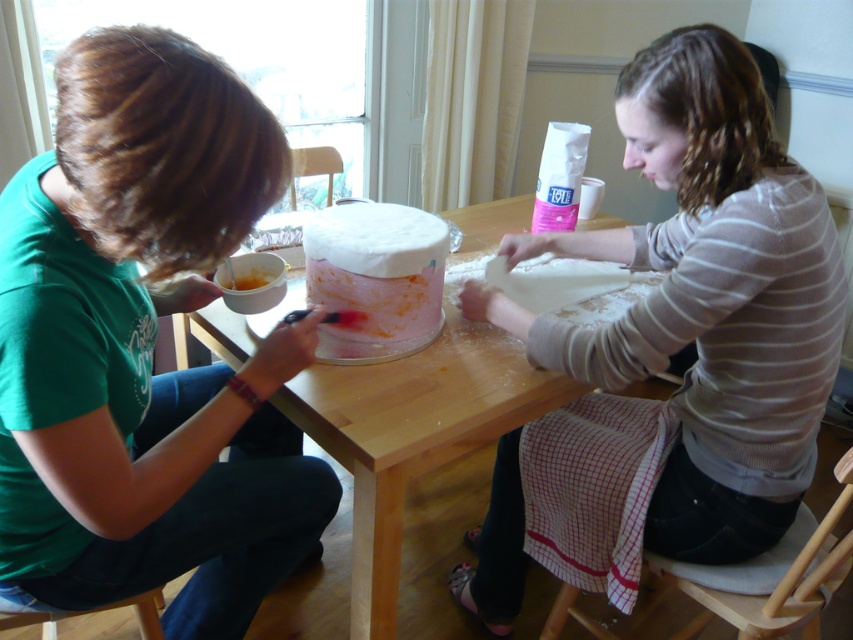
Question: Which object is positioned closest to the wooden table at center?

Choices:
 (A) orange smoothie at center
 (B) white striped sweater at center
 (C) white frosted cake at center
 (D) green matte shirt at left

Answer: (C)

Question: Is white striped sweater at center below orange smoothie at center?

Choices:
 (A) no
 (B) yes

Answer: (B)

Question: Does green matte shirt at left appear on the left side of white frosted cake at center?

Choices:
 (A) no
 (B) yes

Answer: (B)

Question: Does green matte shirt at left appear on the right side of orange smoothie at center?

Choices:
 (A) no
 (B) yes

Answer: (A)

Question: Which object is positioned farthest from the orange smoothie at center?

Choices:
 (A) white frosted cake at center
 (B) green matte shirt at left
 (C) wooden table at center
 (D) white striped sweater at center

Answer: (D)

Question: Which object is positioned farthest from the white frosted cake at center?

Choices:
 (A) orange smoothie at center
 (B) wooden table at center
 (C) white striped sweater at center

Answer: (C)